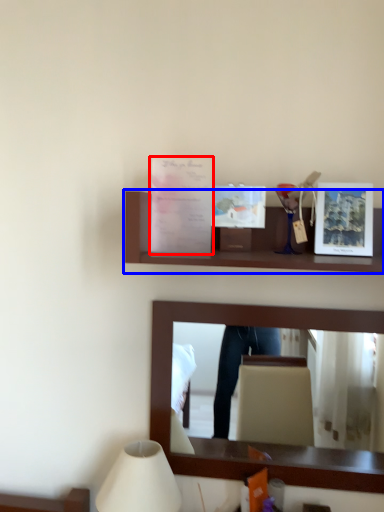
Question: Which object appears farthest to the camera in this image, postcard (highlighted by a red box) or shelf (highlighted by a blue box)?

Choices:
 (A) postcard
 (B) shelf

Answer: (A)